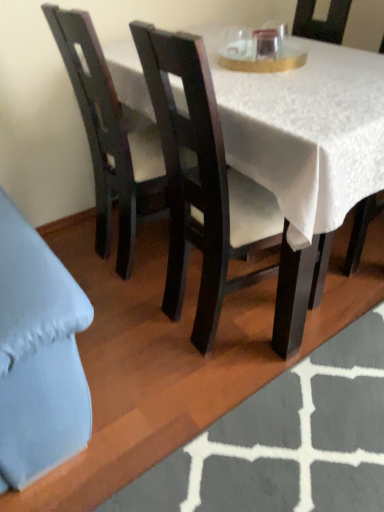
Question: From their relative heights in the image, would you say matte black chair at center, which is counted as the first chair, starting from the right, is taller or shorter than dark wood chair at left, the first chair viewed from the left?

Choices:
 (A) short
 (B) tall

Answer: (A)

Question: From the image's perspective, is matte black chair at center, which is the third chair from left to right, located above or below dark wood chair at left, the first chair viewed from the left?

Choices:
 (A) above
 (B) below

Answer: (A)

Question: Estimate the real-world distances between objects in this image. Which object is farther from the transparent glass at upper center?

Choices:
 (A) matte black chair at center, which is the third chair from left to right
 (B) dark wood chair at left, the first chair viewed from the left
 (C) matte dark wood chair at center, which is the 2th chair in right-to-left order
 (D) white textured rug at lower center

Answer: (D)

Question: Which object is the farthest from the matte black chair at center, which is the third chair from left to right?

Choices:
 (A) transparent glass at upper center
 (B) white textured rug at lower center
 (C) dark wood chair at left, which is the third chair in right-to-left order
 (D) matte dark wood chair at center, which is the 2th chair in left-to-right order

Answer: (B)